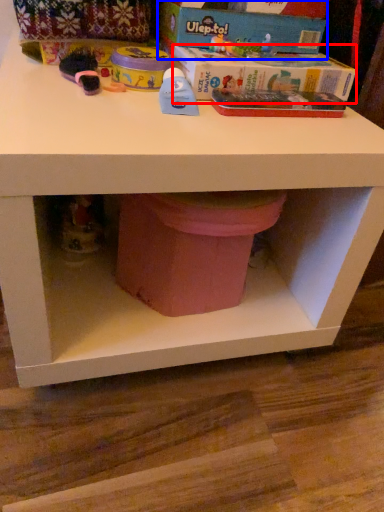
Question: Which of the following is the closest to the observer, box (highlighted by a red box) or box (highlighted by a blue box)?

Choices:
 (A) box
 (B) box

Answer: (A)